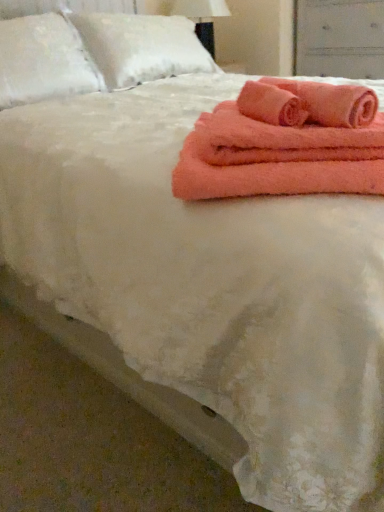
Image resolution: width=384 pixels, height=512 pixels. What do you see at coordinates (202, 17) in the screenshot?
I see `white fabric lampshade at upper center` at bounding box center [202, 17].

Where is `white fluffy pillow at upper left, placed as the 2th pillow when sorted from right to left`? white fluffy pillow at upper left, placed as the 2th pillow when sorted from right to left is located at coordinates (43, 60).

Find the location of a particular element. The height and width of the screenshot is (512, 384). matte white drawer at upper right is located at coordinates (340, 38).

Image resolution: width=384 pixels, height=512 pixels. I want to click on coral fleece towels at upper right, so click(285, 143).

Is matte white drawer at upper right facing away from white fabric lampshade at upper center?

No, matte white drawer at upper right is not facing the opposite direction of white fabric lampshade at upper center.

Can you confirm if matte white drawer at upper right is taller than white fabric lampshade at upper center?

Correct, matte white drawer at upper right is much taller as white fabric lampshade at upper center.

Which object is positioned more to the left, matte white drawer at upper right or white fabric lampshade at upper center?

white fabric lampshade at upper center.

Considering the sizes of objects coral fleece towels at upper right and white fabric lampshade at upper center in the image provided, who is thinner, coral fleece towels at upper right or white fabric lampshade at upper center?

white fabric lampshade at upper center.

Is coral fleece towels at upper right in front of or behind white fabric lampshade at upper center in the image?

Visually, coral fleece towels at upper right is located in front of white fabric lampshade at upper center.

Is coral fleece towels at upper right with white fabric lampshade at upper center?

There is a gap between coral fleece towels at upper right and white fabric lampshade at upper center.

Looking at the image, does white fluffy pillow at upper left, placed as the 2th pillow when sorted from right to left, seem bigger or smaller compared to coral fleece towels at upper right?

In the image, white fluffy pillow at upper left, placed as the 2th pillow when sorted from right to left, appears to be larger than coral fleece towels at upper right.

Which object is more forward, white fluffy pillow at upper left, the 1th pillow viewed from the left, or coral fleece towels at upper right?

coral fleece towels at upper right is in front.

Which pillow is the 2nd one when counting from the left side of the coral fleece towels at upper right? Please provide its 2D coordinates.

[(43, 60)]

In the image, is coral fleece towels at upper right on the left side or the right side of white fluffy pillow at upper left, placed as the second pillow when sorted from left to right?

coral fleece towels at upper right is positioned on white fluffy pillow at upper left, placed as the second pillow when sorted from left to right,'s right side.

From the image's perspective, would you say coral fleece towels at upper right is shown under white fluffy pillow at upper left, placed as the second pillow when sorted from left to right?

Yes, from the image's perspective, coral fleece towels at upper right is beneath white fluffy pillow at upper left, placed as the second pillow when sorted from left to right.

Considering the sizes of objects coral fleece towels at upper right and white fluffy pillow at upper left, placed as the second pillow when sorted from left to right, in the image provided, who is bigger, coral fleece towels at upper right or white fluffy pillow at upper left, placed as the second pillow when sorted from left to right,?

With larger size is white fluffy pillow at upper left, placed as the second pillow when sorted from left to right.

Is coral fleece towels at upper right inside the boundaries of white fluffy pillow at upper left, which is the 1th pillow in right-to-left order, or outside?

coral fleece towels at upper right lies outside white fluffy pillow at upper left, which is the 1th pillow in right-to-left order.

From the image's perspective, is white fluffy pillow at upper left, placed as the 2th pillow when sorted from right to left, on top of coral plush bath towel at upper right?

Indeed, from the image's perspective, white fluffy pillow at upper left, placed as the 2th pillow when sorted from right to left, is shown above coral plush bath towel at upper right.

Which is nearer, (7, 67) or (344, 91)?

Point (7, 67) is positioned farther from the camera compared to point (344, 91).

From a real-world perspective, who is located higher, white fluffy pillow at upper left, the 1th pillow viewed from the left, or coral plush bath towel at upper right?

white fluffy pillow at upper left, the 1th pillow viewed from the left.

Considering the relative sizes of white fluffy pillow at upper left, the 1th pillow viewed from the left, and coral plush bath towel at upper right in the image provided, is white fluffy pillow at upper left, the 1th pillow viewed from the left, thinner than coral plush bath towel at upper right?

In fact, white fluffy pillow at upper left, the 1th pillow viewed from the left, might be wider than coral plush bath towel at upper right.

Find the location of `bath towel in front of the white fabric lampshade at upper center`. bath towel in front of the white fabric lampshade at upper center is located at coordinates (332, 102).

Considering the relative sizes of coral plush bath towel at upper right and white fabric lampshade at upper center in the image provided, is coral plush bath towel at upper right wider than white fabric lampshade at upper center?

Incorrect, the width of coral plush bath towel at upper right does not surpass that of white fabric lampshade at upper center.

Which object is further away from the camera, coral plush bath towel at upper right or white fabric lampshade at upper center?

white fabric lampshade at upper center is further from the camera.

Are white fluffy pillow at upper left, which is the 1th pillow in right-to-left order, and coral plush bath towel at upper right making contact?

No, white fluffy pillow at upper left, which is the 1th pillow in right-to-left order, is not with coral plush bath towel at upper right.

Is white fluffy pillow at upper left, placed as the second pillow when sorted from left to right, at the right side of coral plush bath towel at upper right?

No, white fluffy pillow at upper left, placed as the second pillow when sorted from left to right, is not to the right of coral plush bath towel at upper right.

Is white fluffy pillow at upper left, placed as the second pillow when sorted from left to right, positioned with its back to coral plush bath towel at upper right?

No, white fluffy pillow at upper left, placed as the second pillow when sorted from left to right, is not facing the opposite direction of coral plush bath towel at upper right.

Is white fluffy pillow at upper left, which is the 1th pillow in right-to-left order, bigger than coral plush bath towel at upper right?

Indeed, white fluffy pillow at upper left, which is the 1th pillow in right-to-left order, has a larger size compared to coral plush bath towel at upper right.

This screenshot has height=512, width=384. Identify the location of bedside lamp located above the matte white drawer at upper right (from the image's perspective). (202, 17).

This screenshot has height=512, width=384. In order to click on bedside lamp on the left of coral fleece towels at upper right in this screenshot , I will do `click(202, 17)`.

Considering their positions, is matte white drawer at upper right positioned further to white fluffy pillow at upper left, placed as the second pillow when sorted from left to right, than coral fleece towels at upper right?

The object further to white fluffy pillow at upper left, placed as the second pillow when sorted from left to right, is coral fleece towels at upper right.

When comparing their distances from white fluffy pillow at upper left, placed as the 2th pillow when sorted from right to left, does white fluffy pillow at upper left, which is the 1th pillow in right-to-left order, or matte white drawer at upper right seem closer?

white fluffy pillow at upper left, which is the 1th pillow in right-to-left order, is positioned closer to the anchor white fluffy pillow at upper left, placed as the 2th pillow when sorted from right to left.

Looking at the image, which one is located closer to coral plush bath towel at upper right, white fluffy pillow at upper left, placed as the second pillow when sorted from left to right, or matte white drawer at upper right?

white fluffy pillow at upper left, placed as the second pillow when sorted from left to right, is closer to coral plush bath towel at upper right.

When comparing their distances from coral fleece towels at upper right, does matte white drawer at upper right or coral plush bath towel at upper right seem closer?

coral plush bath towel at upper right is positioned closer to the anchor coral fleece towels at upper right.

Based on their spatial positions, is coral fleece towels at upper right or white fluffy pillow at upper left, the 1th pillow viewed from the left, closer to matte white drawer at upper right?

Based on the image, white fluffy pillow at upper left, the 1th pillow viewed from the left, appears to be nearer to matte white drawer at upper right.

Estimate the real-world distances between objects in this image. Which object is further from coral plush bath towel at upper right, white fluffy pillow at upper left, placed as the 2th pillow when sorted from right to left, or white fluffy pillow at upper left, placed as the second pillow when sorted from left to right?

The object further to coral plush bath towel at upper right is white fluffy pillow at upper left, placed as the second pillow when sorted from left to right.

When comparing their distances from coral fleece towels at upper right, does white fluffy pillow at upper left, placed as the 2th pillow when sorted from right to left, or white fluffy pillow at upper left, which is the 1th pillow in right-to-left order, seem closer?

white fluffy pillow at upper left, placed as the 2th pillow when sorted from right to left, is closer to coral fleece towels at upper right.

Which object lies further to the anchor point coral plush bath towel at upper right, white fluffy pillow at upper left, placed as the 2th pillow when sorted from right to left, or matte white drawer at upper right?

matte white drawer at upper right is positioned further to the anchor coral plush bath towel at upper right.

Identify the location of bath towel located between coral fleece towels at upper right and white fabric lampshade at upper center in the depth direction. Image resolution: width=384 pixels, height=512 pixels. (332, 102).

At what (x,y) coordinates should I click in order to perform the action: click on towel located between white fluffy pillow at upper left, the 1th pillow viewed from the left, and matte white drawer at upper right in the left-right direction. Please return your answer as a coordinate pair (x, y). Looking at the image, I should click on (285, 143).

Find the location of a particular element. drawer between coral fleece towels at upper right and white fabric lampshade at upper center along the z-axis is located at coordinates (340, 38).

This screenshot has height=512, width=384. I want to click on bedside lamp located between white fluffy pillow at upper left, placed as the second pillow when sorted from left to right, and matte white drawer at upper right in the left-right direction, so click(202, 17).